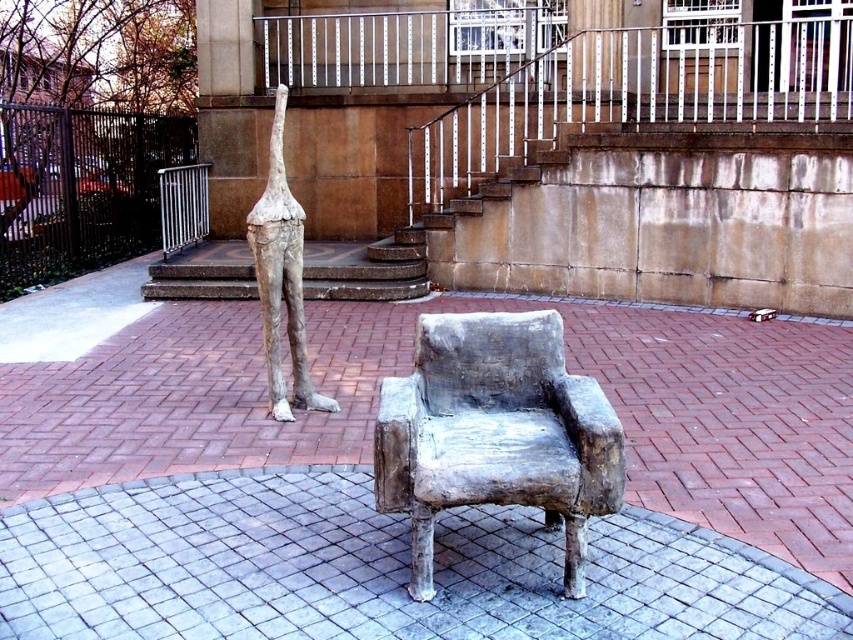
You are a visitor standing in front of the matte concrete armchair at center. You want to take a photo of it without getting too close. If your camera has a maximum zoom of 5 meters, can you capture the entire armchair in the frame from your current position?

The matte concrete armchair at center is 2.63 meters away from the viewer. Since the camera can zoom up to 5 meters, which is farther than the current distance, you can capture the entire armchair in the frame without moving closer.

You are an art curator planning to rearrange the sculptures in the outdoor area. You want to place a new sculpture between the matte concrete armchair at center and the matte gray sculpture at center. Is this possible based on their current positions?

The matte concrete armchair at center is positioned on the right side of the matte gray sculpture at center, meaning there is space between them to place a new sculpture between them.

You are an artist planning to install a new sculpture between the matte concrete armchair at center and the matte gray sculpture at center. The new sculpture must be taller than the shorter object but shorter than the taller one. Which object should you use as the reference for the minimum height requirement?

The matte concrete armchair at center is shorter than the matte gray sculpture at center. Therefore, the minimum height requirement for the new sculpture should be taller than the matte concrete armchair at center.